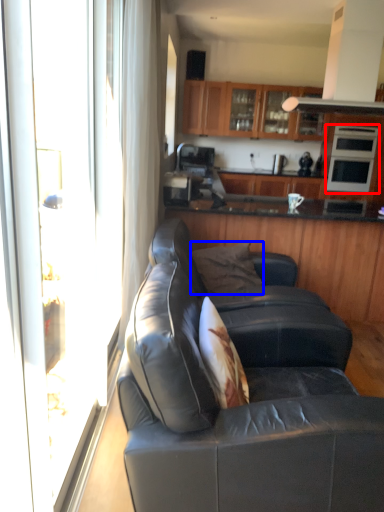
Question: Which point is closer to the camera, appliance (highlighted by a red box) or pillow (highlighted by a blue box)?

Choices:
 (A) appliance
 (B) pillow

Answer: (B)